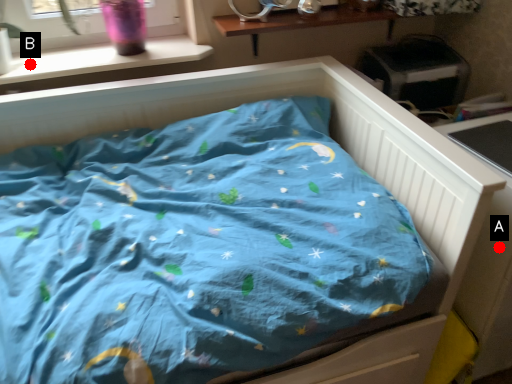
Question: Two points are circled on the image, labeled by A and B beside each circle. Which point is closer to the camera?

Choices:
 (A) A is closer
 (B) B is closer

Answer: (A)